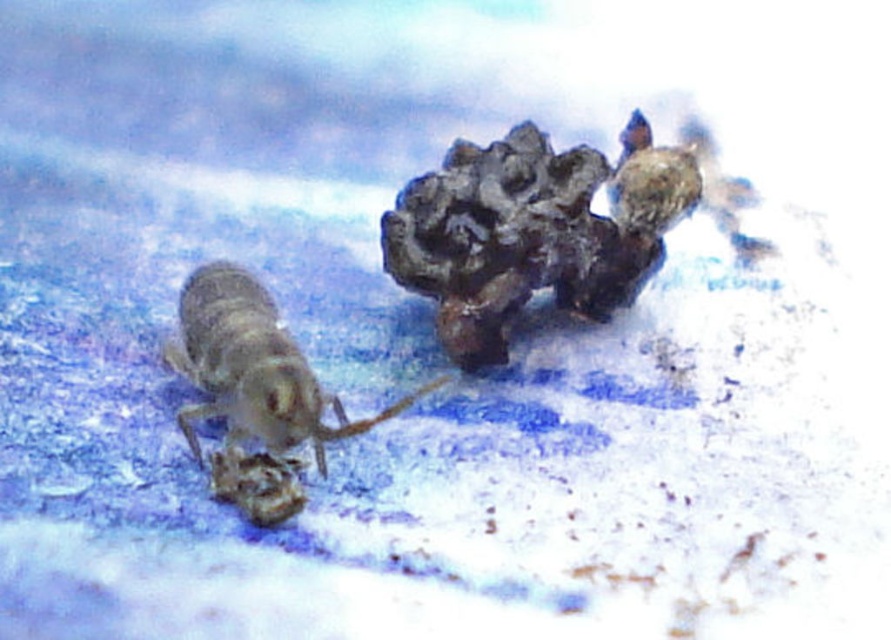
Question: Can you confirm if dark brown textured rock at upper right is positioned below translucent gray insect at left?

Choices:
 (A) yes
 (B) no

Answer: (B)

Question: In this image, where is dark brown textured rock at upper right located relative to translucent gray insect at left?

Choices:
 (A) left
 (B) right

Answer: (B)

Question: Is dark brown textured rock at upper right closer to camera compared to translucent gray insect at left?

Choices:
 (A) yes
 (B) no

Answer: (B)

Question: Which point is farther to the camera?

Choices:
 (A) translucent gray insect at left
 (B) dark brown textured rock at upper right

Answer: (B)